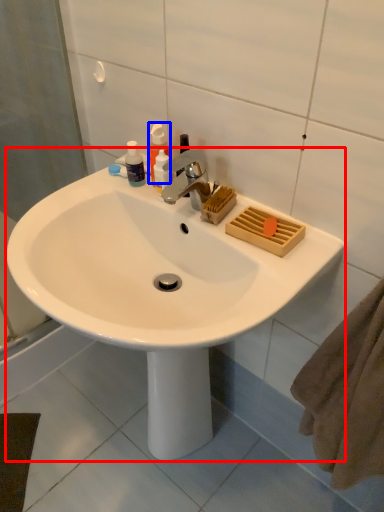
Question: Which point is closer to the camera, sink (highlighted by a red box) or soap dispenser (highlighted by a blue box)?

Choices:
 (A) sink
 (B) soap dispenser

Answer: (A)